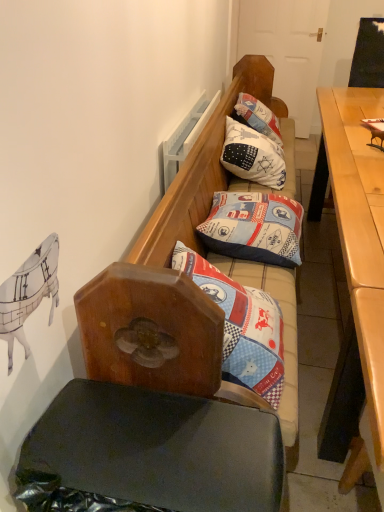
Question: Does patchwork fabric pillow at center, which is counted as the first pillow, starting from the front, appear on the left side of light brown wooden desk at right?

Choices:
 (A) yes
 (B) no

Answer: (A)

Question: Does patchwork fabric pillow at center, which appears as the second pillow when viewed from the back, lie in front of light brown wooden desk at right?

Choices:
 (A) no
 (B) yes

Answer: (A)

Question: Can you confirm if patchwork fabric pillow at center, which appears as the 1th pillow when ordered from the bottom, is shorter than light brown wooden desk at right?

Choices:
 (A) no
 (B) yes

Answer: (B)

Question: Is patchwork fabric pillow at center, placed as the second pillow when sorted from top to bottom, thinner than light brown wooden desk at right?

Choices:
 (A) yes
 (B) no

Answer: (A)

Question: Is light brown wooden desk at right inside patchwork fabric pillow at center, which appears as the 1th pillow when ordered from the bottom?

Choices:
 (A) yes
 (B) no

Answer: (B)

Question: From a real-world perspective, relative to patchwork fabric pillow at upper center, the 2th pillow in the bottom-to-top sequence, is light brown wooden desk at right vertically above or below?

Choices:
 (A) above
 (B) below

Answer: (B)

Question: Is point [362, 303] closer or farther from the camera than point [283, 155]?

Choices:
 (A) farther
 (B) closer

Answer: (B)

Question: From their relative heights in the image, would you say light brown wooden desk at right is taller or shorter than patchwork fabric pillow at upper center, the second pillow when ordered from front to back?

Choices:
 (A) short
 (B) tall

Answer: (B)

Question: In terms of width, does light brown wooden desk at right look wider or thinner when compared to patchwork fabric pillow at upper center, acting as the first pillow starting from the top?

Choices:
 (A) thin
 (B) wide

Answer: (B)

Question: From the image's perspective, is patchwork fabric pillow at center, which is counted as the first pillow, starting from the front, above or below light brown wooden desk at right?

Choices:
 (A) below
 (B) above

Answer: (B)

Question: From a real-world perspective, is patchwork fabric pillow at center, which appears as the second pillow when viewed from the back, physically located above or below light brown wooden desk at right?

Choices:
 (A) above
 (B) below

Answer: (A)

Question: Is patchwork fabric pillow at center, which appears as the second pillow when viewed from the back, inside the boundaries of light brown wooden desk at right, or outside?

Choices:
 (A) inside
 (B) outside

Answer: (B)

Question: Is point (253, 199) closer or farther from the camera than point (377, 271)?

Choices:
 (A) closer
 (B) farther

Answer: (B)

Question: Considering the positions of patchwork fabric pillow at upper center, the 1th pillow when ordered from back to front, and patchwork fabric pillow at center, which appears as the second pillow when viewed from the back, in the image, is patchwork fabric pillow at upper center, the 1th pillow when ordered from back to front, taller or shorter than patchwork fabric pillow at center, which appears as the second pillow when viewed from the back,?

Choices:
 (A) tall
 (B) short

Answer: (A)

Question: Is patchwork fabric pillow at upper center, the 1th pillow when ordered from back to front, bigger or smaller than patchwork fabric pillow at center, which is counted as the first pillow, starting from the front?

Choices:
 (A) big
 (B) small

Answer: (A)